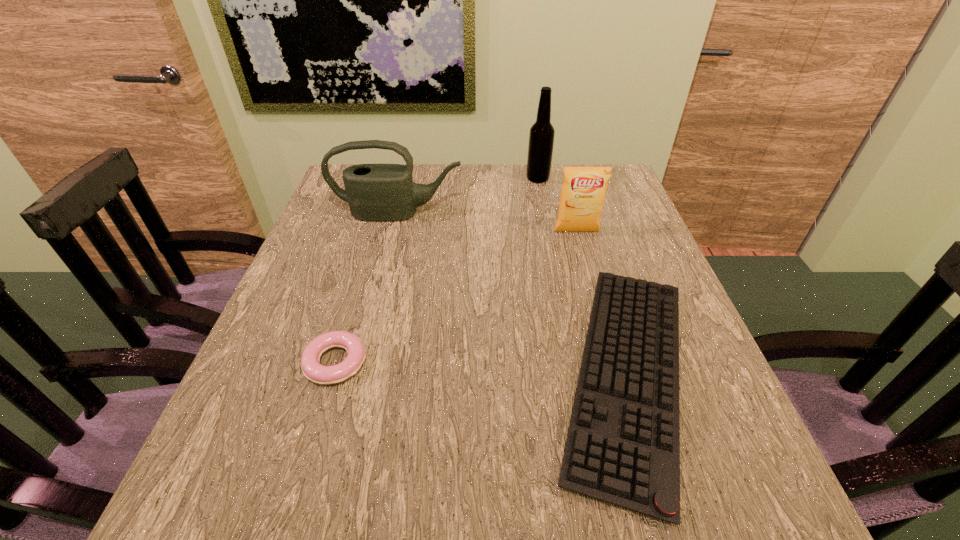
The width and height of the screenshot is (960, 540). I want to click on the tallest object, so click(541, 137).

I want to click on beer bottle, so click(x=541, y=137).

This screenshot has height=540, width=960. I want to click on watering can, so click(x=375, y=192).

You are a GUI agent. You are given a task and a screenshot of the screen. Output one action in this format:
    pyautogui.click(x=<x>, y=<y>)
    Task: Click on the third nearest object
    This screenshot has width=960, height=540.
    Given the screenshot: What is the action you would take?
    pyautogui.click(x=583, y=192)

Identify the location of doughnut. The image size is (960, 540). (324, 375).

Locate an element on the screen. computer keyboard is located at coordinates click(x=623, y=446).

The width and height of the screenshot is (960, 540). In order to click on vacant position located 0.290m on the front of the beer bottle in this screenshot , I will do `click(551, 247)`.

At what (x,y) coordinates should I click in order to perform the action: click on free location located on the spout of the watering can. Please return your answer as a coordinate pair (x, y). Looking at the image, I should click on (381, 281).

Where is `vacant space located on the front of the crisp (potato chip) with the logo`? The image size is (960, 540). vacant space located on the front of the crisp (potato chip) with the logo is located at coordinates coord(584,256).

Locate an element on the screen. free spot located on the right of the doughnut is located at coordinates (549, 363).